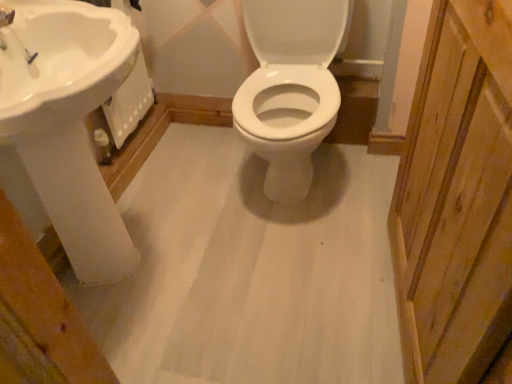
Identify the location of natural wood screen door at right. This screenshot has height=384, width=512. (457, 197).

This screenshot has width=512, height=384. What do you see at coordinates (457, 197) in the screenshot? I see `natural wood screen door at right` at bounding box center [457, 197].

What is the approximate width of natural wood screen door at right?

natural wood screen door at right is 3.77 inches in width.

The width and height of the screenshot is (512, 384). What do you see at coordinates (68, 122) in the screenshot?
I see `white glossy sink at upper left` at bounding box center [68, 122].

Find the location of a particular element. The width and height of the screenshot is (512, 384). white glossy sink at upper left is located at coordinates (68, 122).

Find the location of a particular element. The image size is (512, 384). natural wood screen door at right is located at coordinates (457, 197).

Can you confirm if white glossy sink at upper left is positioned to the left of natural wood screen door at right?

Indeed, white glossy sink at upper left is positioned on the left side of natural wood screen door at right.

Is white glossy sink at upper left closer to the viewer compared to natural wood screen door at right?

No, it is not.

Between point (39, 183) and point (470, 217), which one is positioned behind?

The point (39, 183) is farther from the camera.

From the image's perspective, between white glossy sink at upper left and natural wood screen door at right, who is located below?

natural wood screen door at right appears lower in the image.

From a real-world perspective, who is located lower, white glossy sink at upper left or natural wood screen door at right?

white glossy sink at upper left is physically lower.

Considering the sizes of objects white glossy sink at upper left and natural wood screen door at right in the image provided, who is thinner, white glossy sink at upper left or natural wood screen door at right?

natural wood screen door at right is thinner.

Which of these two, white glossy sink at upper left or natural wood screen door at right, stands shorter?

With less height is white glossy sink at upper left.

Considering the relative sizes of white glossy sink at upper left and natural wood screen door at right in the image provided, is white glossy sink at upper left smaller than natural wood screen door at right?

No.

Is white glossy sink at upper left inside the boundaries of natural wood screen door at right, or outside?

white glossy sink at upper left cannot be found inside natural wood screen door at right.

Is there a large distance between white glossy sink at upper left and natural wood screen door at right?

No, white glossy sink at upper left is not far from natural wood screen door at right.

Is white glossy sink at upper left facing away from natural wood screen door at right?

No, white glossy sink at upper left's orientation is not away from natural wood screen door at right.

What's the angular difference between white glossy sink at upper left and natural wood screen door at right's facing directions?

There is a 175-degree angle between the facing directions of white glossy sink at upper left and natural wood screen door at right.

There is a white glossy sink at upper left. Where is `screen door above it (from a real-world perspective)`? Image resolution: width=512 pixels, height=384 pixels. screen door above it (from a real-world perspective) is located at coordinates (457, 197).

Considering the relative positions of natural wood screen door at right and white glossy sink at upper left in the image provided, is natural wood screen door at right to the right of white glossy sink at upper left from the viewer's perspective?

Indeed, natural wood screen door at right is positioned on the right side of white glossy sink at upper left.

Considering the positions of objects natural wood screen door at right and white glossy sink at upper left in the image provided, who is behind, natural wood screen door at right or white glossy sink at upper left?

white glossy sink at upper left.

Based on the photo, which point is more distant from viewer, (470, 324) or (89, 227)?

The point (89, 227) is farther.

From the image's perspective, which is below, natural wood screen door at right or white glossy sink at upper left?

From the image's view, natural wood screen door at right is below.

From a real-world perspective, is natural wood screen door at right above or below white glossy sink at upper left?

Clearly, from a real-world perspective, natural wood screen door at right is above white glossy sink at upper left.

Does natural wood screen door at right have a lesser width compared to white glossy sink at upper left?

Yes.

From their relative heights in the image, would you say natural wood screen door at right is taller or shorter than white glossy sink at upper left?

Clearly, natural wood screen door at right is taller compared to white glossy sink at upper left.

Who is smaller, natural wood screen door at right or white glossy sink at upper left?

Smaller between the two is natural wood screen door at right.

Is natural wood screen door at right not within white glossy sink at upper left?

natural wood screen door at right is positioned outside white glossy sink at upper left.

Is natural wood screen door at right not near white glossy sink at upper left?

Actually, natural wood screen door at right and white glossy sink at upper left are a little close together.

Is natural wood screen door at right oriented towards white glossy sink at upper left?

Yes, natural wood screen door at right is turned towards white glossy sink at upper left.

This screenshot has height=384, width=512. In order to click on screen door located below the white glossy sink at upper left (from the image's perspective) in this screenshot , I will do `click(457, 197)`.

Locate an element on the screen. This screenshot has height=384, width=512. screen door that appears below the white glossy sink at upper left (from the image's perspective) is located at coordinates (457, 197).

Find the location of `sink above the natural wood screen door at right (from the image's perspective)`. sink above the natural wood screen door at right (from the image's perspective) is located at coordinates (68, 122).